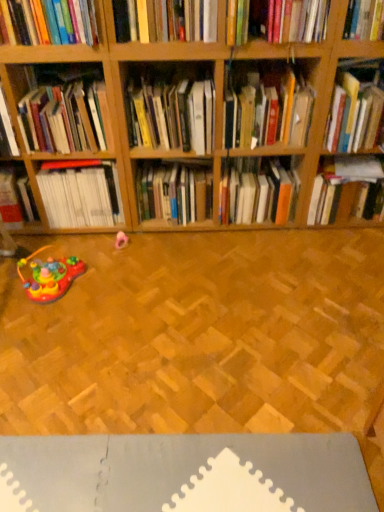
Question: Is point (190, 195) positioned closer to the camera than point (226, 88)?

Choices:
 (A) closer
 (B) farther

Answer: (B)

Question: From their relative heights in the image, would you say hardcover book at center, which ranks as the seventh book in right-to-left order, is taller or shorter than hardcover book at center, which ranks as the 4th book in right-to-left order?

Choices:
 (A) short
 (B) tall

Answer: (B)

Question: Which object is the farthest from the hardcover book at upper left, the third book when ordered from left to right?

Choices:
 (A) hardcover book at center, arranged as the eighth book when viewed from the left
 (B) rubberized plastic toy at lower left, the 1th toy when ordered from front to back
 (C) hardcover book at upper center, which ranks as the 5th book in left-to-right order
 (D) hardcover book at center, placed as the 4th book when sorted from left to right
 (E) hardcover book at center, the ninth book in the left-to-right sequence

Answer: (A)

Question: Which is farther from the hardcover book at upper right, the third book in the right-to-left sequence?

Choices:
 (A) rubberized plastic toy at lower left, the 1th toy when ordered from bottom to top
 (B) hardcover book at upper left, which appears as the tenth book when viewed from the right
 (C) hardcover book at upper center, acting as the seventh book starting from the left
 (D) white matte book at left, the second book from the left
 (E) hardcover book at center, the ninth book in the right-to-left sequence

Answer: (A)